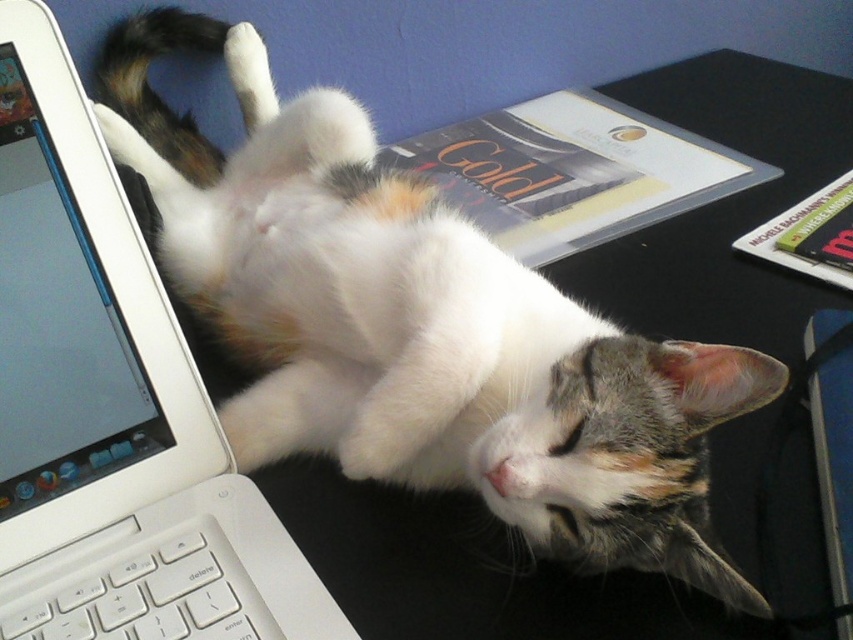
Which is more to the left, white plastic laptop at left or gold paper folder at upper center?

white plastic laptop at left

Between point (65, 509) and point (660, 179), which one is positioned in front?

Point (65, 509)

This screenshot has width=853, height=640. What do you see at coordinates (111, 404) in the screenshot?
I see `white plastic laptop at left` at bounding box center [111, 404].

Locate an element on the screen. The height and width of the screenshot is (640, 853). white plastic laptop at left is located at coordinates (111, 404).

Is gold paper folder at upper center wider than white plastic keyboard at lower left?

Correct, the width of gold paper folder at upper center exceeds that of white plastic keyboard at lower left.

Does gold paper folder at upper center have a greater height compared to white plastic keyboard at lower left?

Correct, gold paper folder at upper center is much taller as white plastic keyboard at lower left.

Who is more distant from viewer, (550,241) or (218,552)?

Point (550,241)

At what (x,y) coordinates should I click in order to perform the action: click on gold paper folder at upper center. Please return your answer as a coordinate pair (x, y). Looking at the image, I should click on (573, 172).

Is white plastic laptop at left taller than white plastic keyboard at lower left?

Yes.

Is point (6, 177) behind point (224, 627)?

Yes, it is behind point (224, 627).

The height and width of the screenshot is (640, 853). Identify the location of white plastic laptop at left. (111, 404).